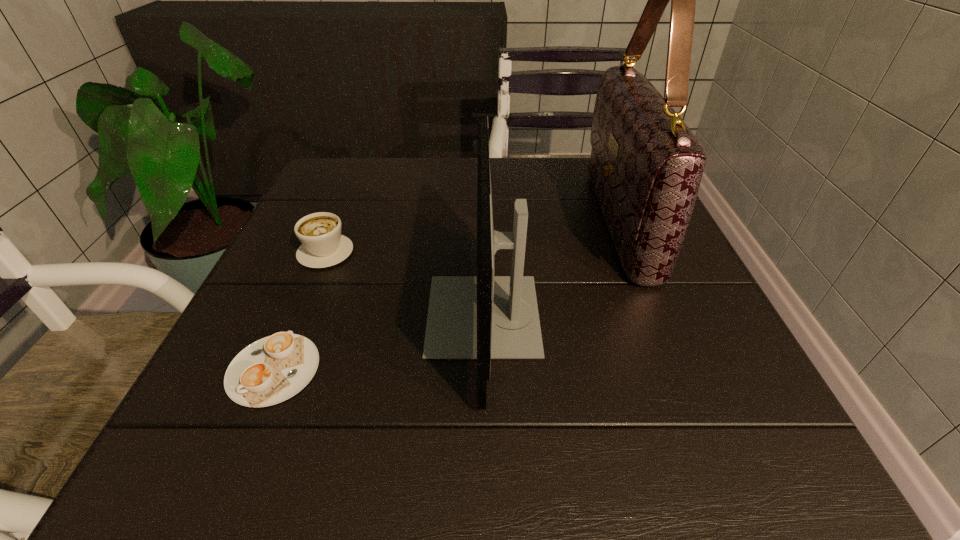
Image resolution: width=960 pixels, height=540 pixels. Find the location of `vacant space located on the front of the rightmost object with the clasp`. vacant space located on the front of the rightmost object with the clasp is located at coordinates (435, 221).

Locate an element on the screen. This screenshot has width=960, height=540. free space located 0.200m on the screen of the computer monitor is located at coordinates (312, 315).

The width and height of the screenshot is (960, 540). I want to click on blank area located on the screen of the computer monitor, so click(x=318, y=315).

What are the coordinates of `free space located on the screen of the computer monitor` in the screenshot? It's located at (300, 315).

Locate an element on the screen. The height and width of the screenshot is (540, 960). vacant position located 0.150m to the right of the farther cappuccino's handle is located at coordinates tap(348, 197).

Where is `vacant point located to the right of the farther cappuccino's handle`? vacant point located to the right of the farther cappuccino's handle is located at coordinates (359, 172).

The height and width of the screenshot is (540, 960). I want to click on vacant space positioned to the right of the farther cappuccino's handle, so click(341, 215).

The image size is (960, 540). I want to click on vacant space situated 0.270m on the right of the nearer cappuccino, so click(x=494, y=370).

This screenshot has width=960, height=540. In order to click on object that is at the far edge in this screenshot , I will do `click(646, 165)`.

Identify the location of object that is at the near edge. The height and width of the screenshot is (540, 960). (483, 317).